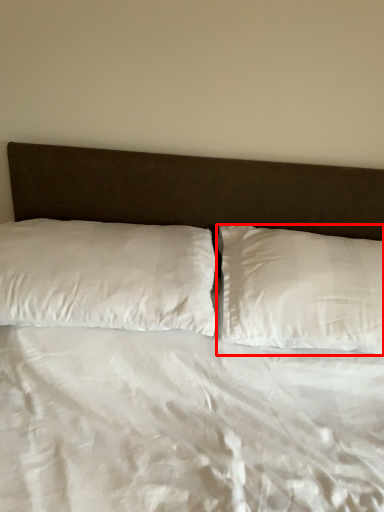
Question: From the image's perspective, what is the correct spatial positioning of pillow (annotated by the red box) in reference to pillow?

Choices:
 (A) above
 (B) below

Answer: (B)